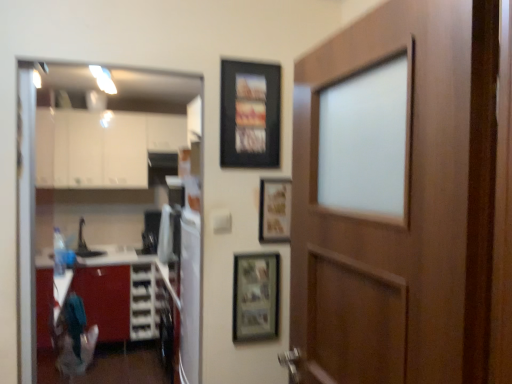
Question: Is transparent glass door at left spatially inside wooden picture frame at center, arranged as the 2th picture frame when ordered from the bottom, or outside of it?

Choices:
 (A) outside
 (B) inside

Answer: (A)

Question: Does point (86, 192) appear closer or farther from the camera than point (284, 195)?

Choices:
 (A) closer
 (B) farther

Answer: (B)

Question: Considering the real-world distances, which object is closest to the transparent glass door at left?

Choices:
 (A) wooden-framed photo at center, the third picture frame viewed from the top
 (B) brushed metal cabinet at lower left, which ranks as the second cabinetry in top-to-bottom order
 (C) black matte picture frame at upper center, the third picture frame from the bottom
 (D) white glossy cabinets at upper left, the first cabinetry positioned from the top
 (E) wooden picture frame at center, arranged as the 2th picture frame when ordered from the bottom

Answer: (B)

Question: Which object is positioned farthest from the brushed metal cabinet at lower left, which ranks as the second cabinetry in top-to-bottom order?

Choices:
 (A) white glossy refrigerator at center
 (B) black matte picture frame at upper center, which is counted as the 1th picture frame, starting from the top
 (C) wooden-framed photo at center, the third picture frame viewed from the top
 (D) transparent glass door at left
 (E) wooden door at right

Answer: (E)